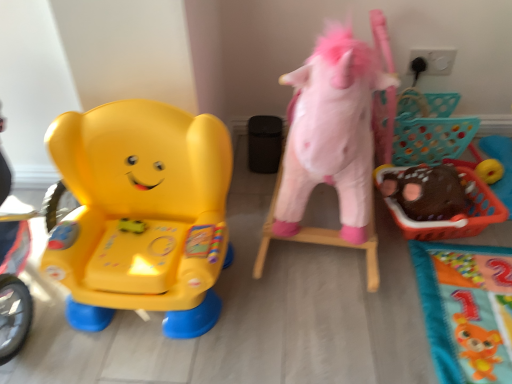
The width and height of the screenshot is (512, 384). I want to click on fluffy pink unicorn at right, which is the 2th toy from left to right, so (336, 140).

Where is `brown fuzzy plush at right, which appears as the first toy when viewed from the right`? The height and width of the screenshot is (384, 512). brown fuzzy plush at right, which appears as the first toy when viewed from the right is located at coordinates (456, 215).

What's the angular difference between matte plastic elephant at left, which appears as the third toy when viewed from the right, and brown fuzzy plush at right, which appears as the 3th toy when viewed from the left,'s facing directions?

The facing directions of matte plastic elephant at left, which appears as the third toy when viewed from the right, and brown fuzzy plush at right, which appears as the 3th toy when viewed from the left, are 1.54 degrees apart.

Considering the sizes of objects matte plastic elephant at left, the first toy viewed from the left, and brown fuzzy plush at right, which appears as the 3th toy when viewed from the left, in the image provided, who is thinner, matte plastic elephant at left, the first toy viewed from the left, or brown fuzzy plush at right, which appears as the 3th toy when viewed from the left,?

brown fuzzy plush at right, which appears as the 3th toy when viewed from the left.

Which of these two, matte plastic elephant at left, the first toy viewed from the left, or brown fuzzy plush at right, which appears as the 3th toy when viewed from the left, stands shorter?

Standing shorter between the two is brown fuzzy plush at right, which appears as the 3th toy when viewed from the left.

From the image's perspective, which toy is the 1st one above the matte plastic elephant at left, the first toy viewed from the left? Please provide its 2D coordinates.

[(456, 215)]

Would you say brown fuzzy plush at right, which appears as the first toy when viewed from the right, is a long distance from matte plastic elephant at left, which appears as the third toy when viewed from the right?

No.

Who is bigger, brown fuzzy plush at right, which appears as the first toy when viewed from the right, or matte plastic elephant at left, the first toy viewed from the left?

Bigger between the two is matte plastic elephant at left, the first toy viewed from the left.

From the image's perspective, which object appears higher, brown fuzzy plush at right, which appears as the first toy when viewed from the right, or matte plastic elephant at left, which appears as the third toy when viewed from the right?

brown fuzzy plush at right, which appears as the first toy when viewed from the right, is shown above in the image.

Which point is more distant from viewer, (374, 286) or (169, 118)?

The point (374, 286) is farther from the camera.

Which of these two, fluffy pink unicorn at right, which is the 2th toy from left to right, or matte plastic elephant at left, which appears as the third toy when viewed from the right, is bigger?

Bigger between the two is fluffy pink unicorn at right, which is the 2th toy from left to right.

Which of these two, fluffy pink unicorn at right, arranged as the 2th toy when viewed from the right, or matte plastic elephant at left, the first toy viewed from the left, is wider?

fluffy pink unicorn at right, arranged as the 2th toy when viewed from the right, is wider.

Is matte plastic elephant at left, the first toy viewed from the left, oriented towards fluffy pink unicorn at right, arranged as the 2th toy when viewed from the right?

No, matte plastic elephant at left, the first toy viewed from the left, does not turn towards fluffy pink unicorn at right, arranged as the 2th toy when viewed from the right.

Considering the positions of point (142, 281) and point (312, 163), is point (142, 281) closer or farther from the camera than point (312, 163)?

Point (142, 281).

Does matte plastic elephant at left, which appears as the third toy when viewed from the right, have a lesser height compared to fluffy pink unicorn at right, which is the 2th toy from left to right?

Yes.

From the image's perspective, between matte plastic elephant at left, which appears as the third toy when viewed from the right, and fluffy pink unicorn at right, which is the 2th toy from left to right, which one is located above?

fluffy pink unicorn at right, which is the 2th toy from left to right, is shown above in the image.

Is brown fuzzy plush at right, which appears as the 3th toy when viewed from the left, completely or partially outside of fluffy pink unicorn at right, arranged as the 2th toy when viewed from the right?

That's correct, brown fuzzy plush at right, which appears as the 3th toy when viewed from the left, is outside of fluffy pink unicorn at right, arranged as the 2th toy when viewed from the right.

From their relative heights in the image, would you say brown fuzzy plush at right, which appears as the 3th toy when viewed from the left, is taller or shorter than fluffy pink unicorn at right, arranged as the 2th toy when viewed from the right?

Clearly, brown fuzzy plush at right, which appears as the 3th toy when viewed from the left, is shorter compared to fluffy pink unicorn at right, arranged as the 2th toy when viewed from the right.

From the image's perspective, which is above, brown fuzzy plush at right, which appears as the 3th toy when viewed from the left, or fluffy pink unicorn at right, which is the 2th toy from left to right?

fluffy pink unicorn at right, which is the 2th toy from left to right, is shown above in the image.

Is brown fuzzy plush at right, which appears as the 3th toy when viewed from the left, facing away from fluffy pink unicorn at right, arranged as the 2th toy when viewed from the right?

brown fuzzy plush at right, which appears as the 3th toy when viewed from the left, is not turned away from fluffy pink unicorn at right, arranged as the 2th toy when viewed from the right.

Which of these two, fluffy pink unicorn at right, arranged as the 2th toy when viewed from the right, or brown fuzzy plush at right, which appears as the first toy when viewed from the right, is wider?

fluffy pink unicorn at right, arranged as the 2th toy when viewed from the right, is wider.

Considering their positions, is fluffy pink unicorn at right, arranged as the 2th toy when viewed from the right, located in front of or behind brown fuzzy plush at right, which appears as the 3th toy when viewed from the left?

Clearly, fluffy pink unicorn at right, arranged as the 2th toy when viewed from the right, is in front of brown fuzzy plush at right, which appears as the 3th toy when viewed from the left.

The height and width of the screenshot is (384, 512). I want to click on the 2nd toy positioned above the brown fuzzy plush at right, which appears as the first toy when viewed from the right (from a real-world perspective), so click(x=336, y=140).

Is fluffy pink unicorn at right, which is the 2th toy from left to right, far away from brown fuzzy plush at right, which appears as the 3th toy when viewed from the left?

No, fluffy pink unicorn at right, which is the 2th toy from left to right, is not far away from brown fuzzy plush at right, which appears as the 3th toy when viewed from the left.

Locate an element on the screen. toy behind the matte plastic elephant at left, which appears as the third toy when viewed from the right is located at coordinates (456, 215).

Image resolution: width=512 pixels, height=384 pixels. What are the coordinates of `the 2nd toy to the right of the matte plastic elephant at left, the first toy viewed from the left, counting from the anchor's position` in the screenshot? It's located at tap(456, 215).

Estimate the real-world distances between objects in this image. Which object is closer to brown fuzzy plush at right, which appears as the first toy when viewed from the right, matte plastic elephant at left, the first toy viewed from the left, or fluffy pink unicorn at right, arranged as the 2th toy when viewed from the right?

Among the two, fluffy pink unicorn at right, arranged as the 2th toy when viewed from the right, is located nearer to brown fuzzy plush at right, which appears as the first toy when viewed from the right.

Considering their positions, is fluffy pink unicorn at right, which is the 2th toy from left to right, positioned further to matte plastic elephant at left, the first toy viewed from the left, than brown fuzzy plush at right, which appears as the 3th toy when viewed from the left?

brown fuzzy plush at right, which appears as the 3th toy when viewed from the left, is positioned further to the anchor matte plastic elephant at left, the first toy viewed from the left.

Which object lies nearer to the anchor point fluffy pink unicorn at right, which is the 2th toy from left to right, matte plastic elephant at left, which appears as the third toy when viewed from the right, or brown fuzzy plush at right, which appears as the first toy when viewed from the right?

The object closer to fluffy pink unicorn at right, which is the 2th toy from left to right, is brown fuzzy plush at right, which appears as the first toy when viewed from the right.

Which object lies nearer to the anchor point matte plastic elephant at left, which appears as the third toy when viewed from the right, brown fuzzy plush at right, which appears as the 3th toy when viewed from the left, or fluffy pink unicorn at right, arranged as the 2th toy when viewed from the right?

The object closer to matte plastic elephant at left, which appears as the third toy when viewed from the right, is fluffy pink unicorn at right, arranged as the 2th toy when viewed from the right.

When comparing their distances from brown fuzzy plush at right, which appears as the first toy when viewed from the right, does fluffy pink unicorn at right, which is the 2th toy from left to right, or matte plastic elephant at left, which appears as the third toy when viewed from the right, seem further?

matte plastic elephant at left, which appears as the third toy when viewed from the right, is further to brown fuzzy plush at right, which appears as the first toy when viewed from the right.

When comparing their distances from fluffy pink unicorn at right, which is the 2th toy from left to right, does brown fuzzy plush at right, which appears as the 3th toy when viewed from the left, or matte plastic elephant at left, the first toy viewed from the left, seem closer?

The object closer to fluffy pink unicorn at right, which is the 2th toy from left to right, is brown fuzzy plush at right, which appears as the 3th toy when viewed from the left.

This screenshot has width=512, height=384. Find the location of `toy between matte plastic elephant at left, the first toy viewed from the left, and brown fuzzy plush at right, which appears as the 3th toy when viewed from the left, from left to right`. toy between matte plastic elephant at left, the first toy viewed from the left, and brown fuzzy plush at right, which appears as the 3th toy when viewed from the left, from left to right is located at coordinates (336, 140).